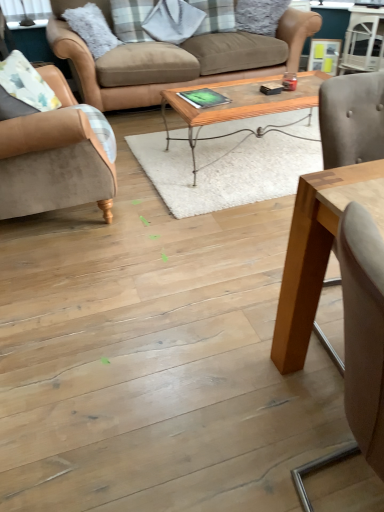
Question: In terms of size, does woodenwoodencoffee table at center, arranged as the second coffee table when viewed from the front, appear bigger or smaller than wooden table at center, which is the first coffee table from bottom to top?

Choices:
 (A) small
 (B) big

Answer: (B)

Question: Is woodenwoodencoffee table at center, the first coffee table viewed from the back, wider or thinner than wooden table at center, which is the 2th coffee table in back-to-front order?

Choices:
 (A) thin
 (B) wide

Answer: (B)

Question: Estimate the real-world distances between objects in this image. Which object is farther from the light brown wood swivel chair at right?

Choices:
 (A) wooden table at center, arranged as the first coffee table when viewed from the front
 (B) woodenwoodencoffee table at center, the first coffee table viewed from the back
 (C) suede beige armchair at left
 (D) brown leather couch at upper center

Answer: (D)

Question: Which object is positioned closest to the wooden table at center, which appears as the second coffee table when viewed from the top?

Choices:
 (A) light brown wood swivel chair at right
 (B) suede beige armchair at left
 (C) brown leather couch at upper center
 (D) woodenwoodencoffee table at center, placed as the first coffee table when sorted from top to bottom

Answer: (A)